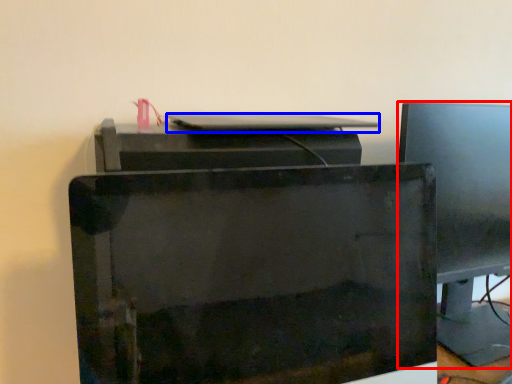
Question: Which of the following is the closest to the observer, computer monitor (highlighted by a red box) or desktop (highlighted by a blue box)?

Choices:
 (A) computer monitor
 (B) desktop

Answer: (B)